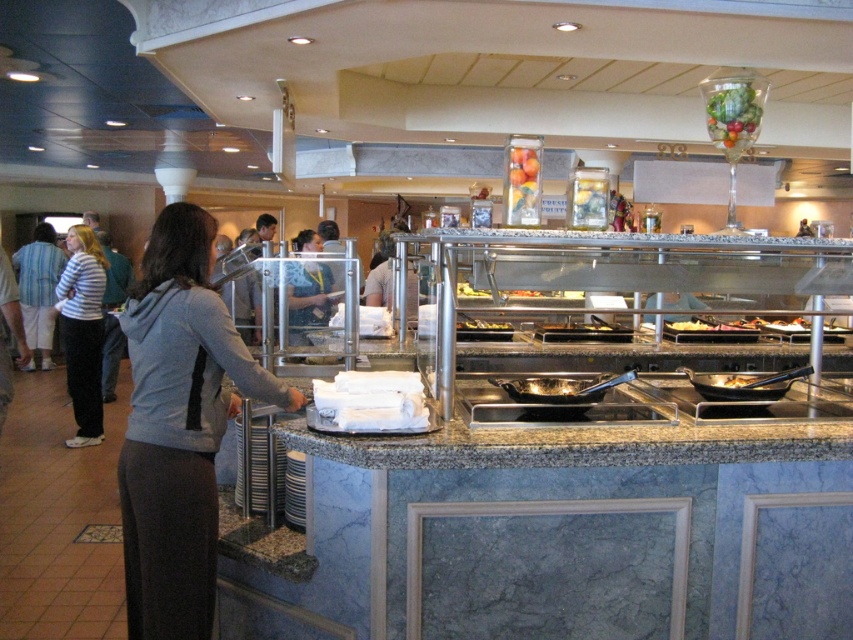
Question: Does gray fabric jacket at center lie in front of shiny glass vase at upper center?

Choices:
 (A) yes
 (B) no

Answer: (A)

Question: Is shiny glass bowl at upper center smaller than shiny glass vase at upper center?

Choices:
 (A) no
 (B) yes

Answer: (A)

Question: Which of the following is the farthest from the observer?

Choices:
 (A) shiny glass bowl at upper center
 (B) shiny glass vase at upper center
 (C) gray fabric jacket at center

Answer: (A)

Question: Can you confirm if shiny glass bowl at upper center is positioned to the right of shiny silver pan at center?

Choices:
 (A) no
 (B) yes

Answer: (B)

Question: Which of the following is the farthest from the observer?

Choices:
 (A) (730, 76)
 (B) (500, 326)
 (C) (154, 547)

Answer: (B)

Question: Which point is farther from the camera taking this photo?

Choices:
 (A) (93, 420)
 (B) (740, 144)
 (C) (524, 205)
 (D) (143, 513)

Answer: (A)